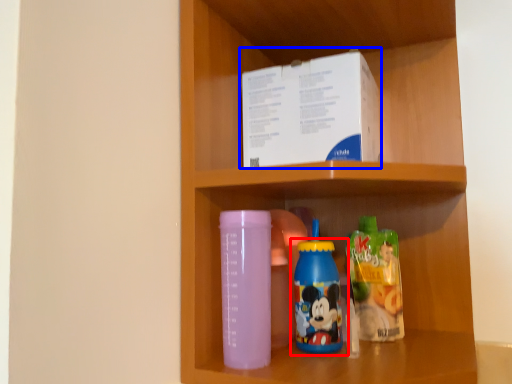
Question: Which of the following is the closest to the observer, bottle (highlighted by a red box) or box (highlighted by a blue box)?

Choices:
 (A) bottle
 (B) box

Answer: (A)